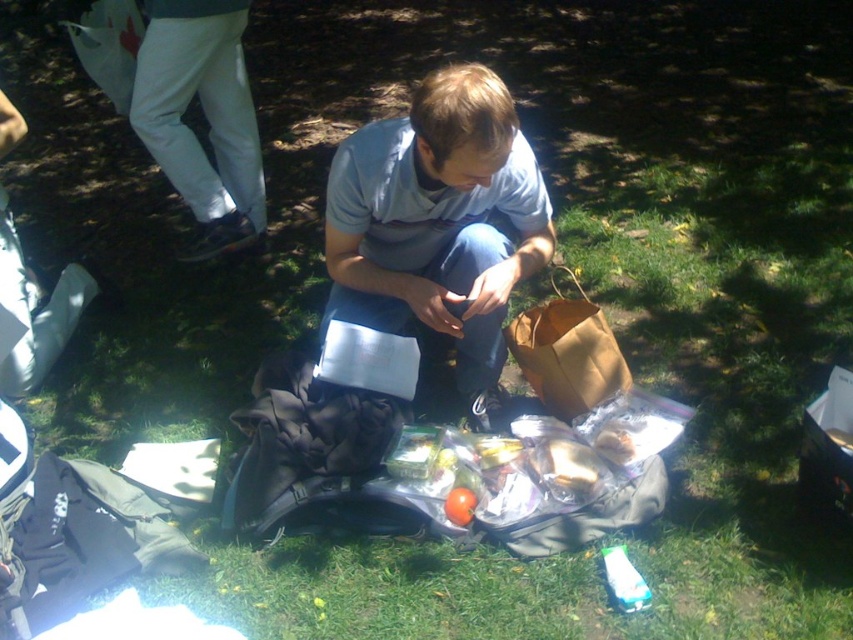
Between point (456, 316) and point (619, 552), which one is positioned behind?

The point (456, 316) is behind.

Locate an element on the screen. matte gray shirt at center is located at coordinates (439, 221).

Who is lower down, matte gray shirt at center or shiny plastic container at center?

Positioned lower is shiny plastic container at center.

Which is more to the left, matte gray shirt at center or shiny plastic container at center?

Positioned to the left is matte gray shirt at center.

Is point (326, 321) farther from viewer compared to point (460, 500)?

Yes.

At what (x,y) coordinates should I click in order to perform the action: click on matte gray shirt at center. Please return your answer as a coordinate pair (x, y). The image size is (853, 640). Looking at the image, I should click on tap(439, 221).

Can you confirm if brown paper bag at center is wider than shiny plastic container at center?

Yes.

Between point (585, 342) and point (466, 497), which one is positioned behind?

The point (585, 342) is more distant.

Locate an element on the screen. The width and height of the screenshot is (853, 640). brown paper bag at center is located at coordinates (567, 353).